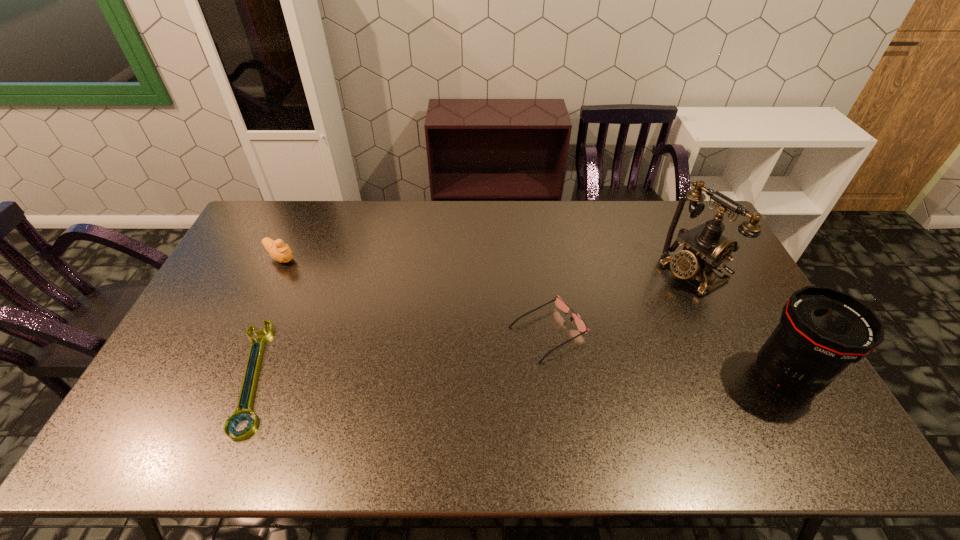
Identify the location of telephoto lens present at the right edge. This screenshot has height=540, width=960. (822, 330).

Identify the location of telephone present at the right edge. This screenshot has height=540, width=960. (704, 248).

Locate an element on the screen. This screenshot has height=540, width=960. object at the near right corner is located at coordinates (822, 330).

At what (x,y) coordinates should I click in order to perform the action: click on free point at the far edge. Please return your answer as a coordinate pair (x, y). Looking at the image, I should click on (601, 237).

The height and width of the screenshot is (540, 960). Identify the location of free space at the near edge. (605, 389).

This screenshot has height=540, width=960. Identify the location of vacant space at the left edge. tap(228, 315).

Find the location of a particular element. This screenshot has height=540, width=960. vacant region at the right edge of the desktop is located at coordinates (739, 298).

This screenshot has height=540, width=960. Find the location of `free space at the far right corner`. free space at the far right corner is located at coordinates (665, 211).

Find the location of `vacant area that lies between the duckling and the fourth tallest object`. vacant area that lies between the duckling and the fourth tallest object is located at coordinates (415, 295).

Where is `free area in between the duckling and the tallest object`? The width and height of the screenshot is (960, 540). free area in between the duckling and the tallest object is located at coordinates (487, 265).